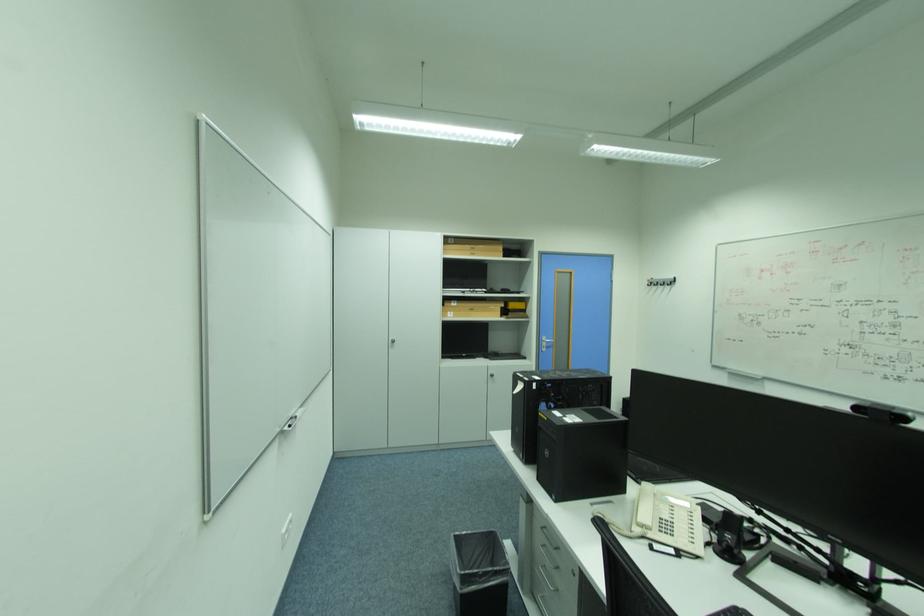
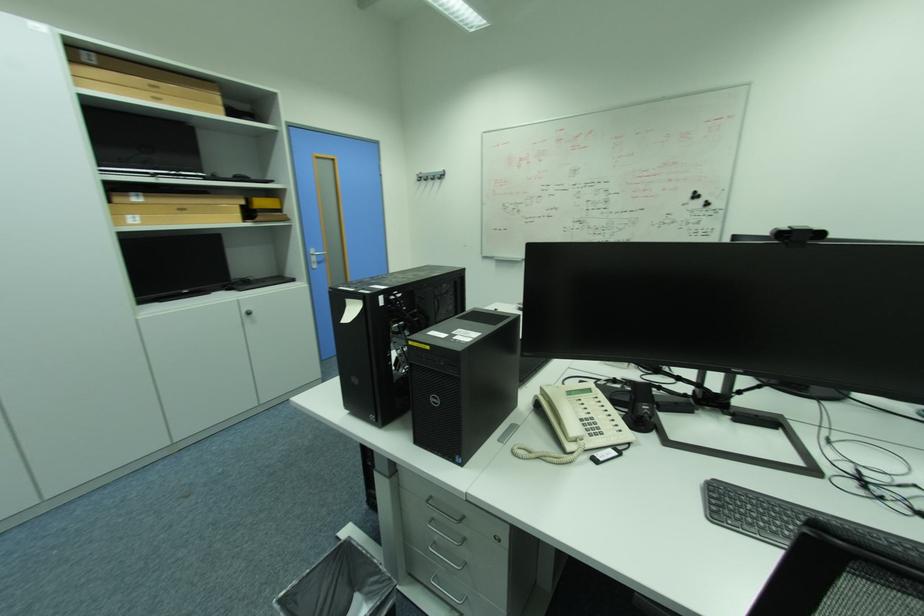
Question: The images are taken continuously from a first-person perspective. In which direction is your viewpoint rotating?

Choices:
 (A) Left
 (B) Right
 (C) Up
 (D) Down

Answer: (B)